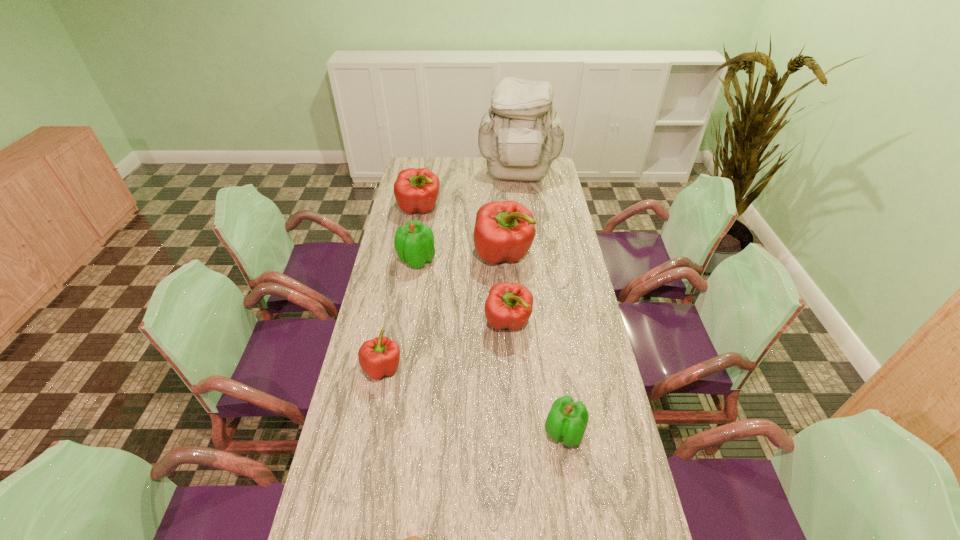
The height and width of the screenshot is (540, 960). In order to click on free region that satisfies the following two spatial constraints: 1. on the front side of the third biggest pink bell pepper; 2. on the left side of the left green bell pepper in this screenshot , I will do `click(407, 323)`.

Locate an element on the screen. The width and height of the screenshot is (960, 540). vacant space that satisfies the following two spatial constraints: 1. on the back side of the second nearest bell pepper; 2. on the left side of the farthest pink bell pepper is located at coordinates (413, 210).